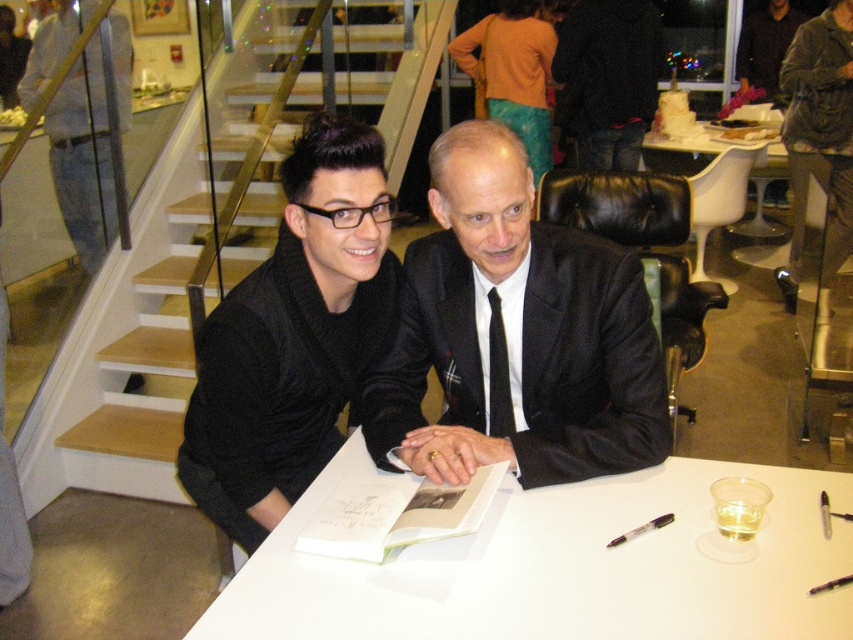
You are organizing a small event and need to place a 1.5 meter long banner between the white matte table at center and the black silk suit at center. Based on their sizes, will the banner fit between them?

The white matte table at center is smaller than the black silk suit at center. Since the banner is 1.5 meters long, it might not fit between them if the distance between the two objects is less than 1.5 meters. However, the size comparison provided doesn not give information about the actual distance between them, so we cannot determine if the banner will fit based solely on their sizes.